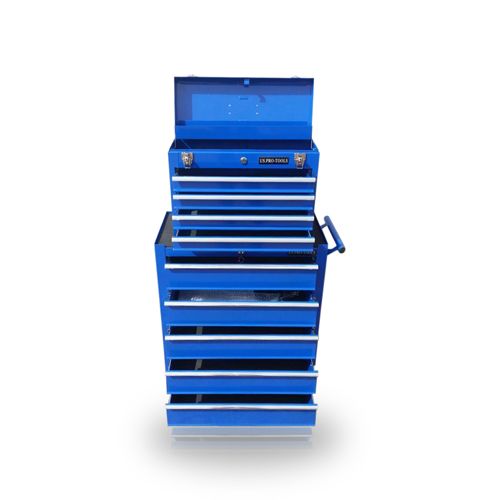
Locate an element on the screen. handle is located at coordinates (334, 232).